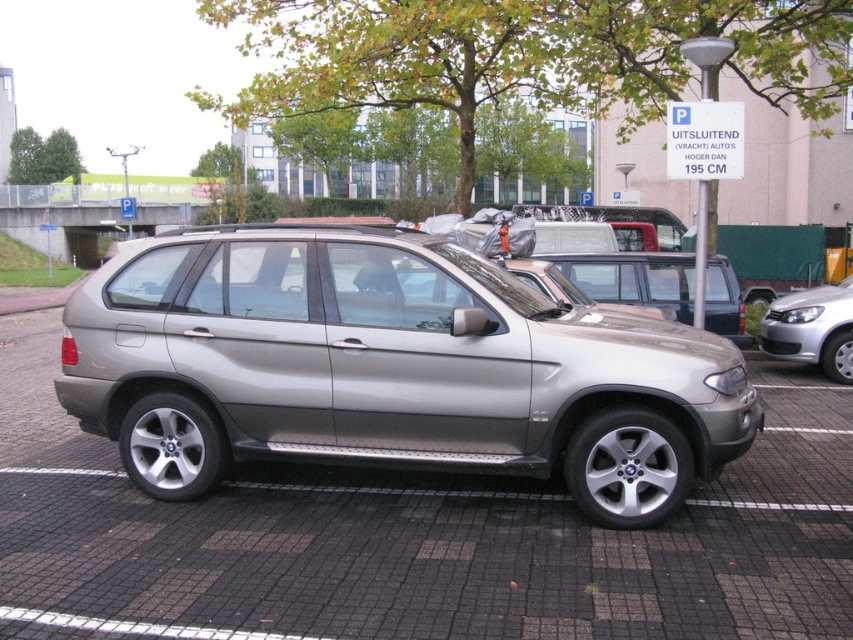
Question: Can you confirm if satin silver minivan at center is smaller than satin silver car at right?

Choices:
 (A) no
 (B) yes

Answer: (A)

Question: Among these points, which one is nearest to the camera?

Choices:
 (A) (244, 337)
 (B) (160, 636)

Answer: (B)

Question: Does satin silver car at center have a greater width compared to satin silver minivan at center?

Choices:
 (A) yes
 (B) no

Answer: (A)

Question: Which object is farther from the camera taking this photo?

Choices:
 (A) satin silver suv at center
 (B) satin silver car at right
 (C) satin silver minivan at center
 (D) satin silver car at center

Answer: (B)

Question: Considering the relative positions of satin silver suv at center and satin silver car at right in the image provided, where is satin silver suv at center located with respect to satin silver car at right?

Choices:
 (A) above
 (B) below

Answer: (B)

Question: Which point is closer to the camera taking this photo?

Choices:
 (A) (648, 273)
 (B) (845, 307)

Answer: (A)